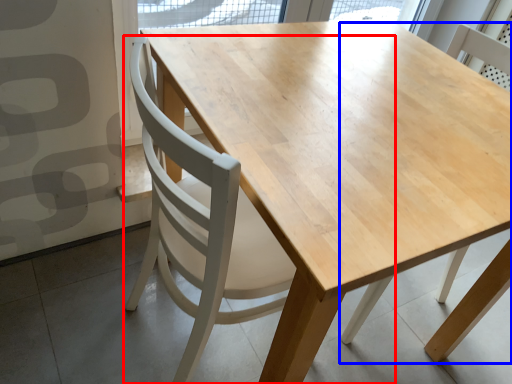
Question: Which of the following is the farthest to the observer, chair (highlighted by a red box) or chair (highlighted by a blue box)?

Choices:
 (A) chair
 (B) chair

Answer: (B)